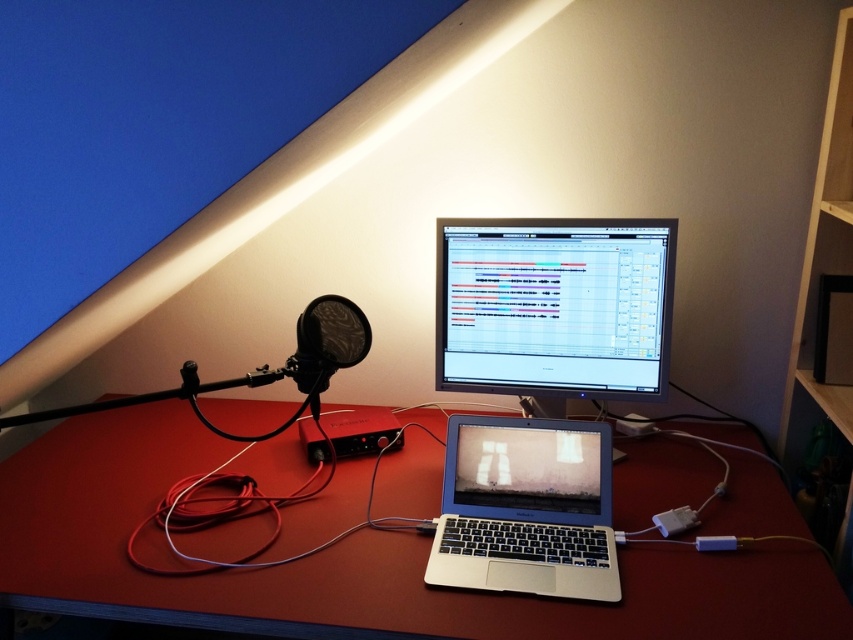
Question: Can you confirm if smooth wooden desk at center is smaller than matte black microphone at left?

Choices:
 (A) no
 (B) yes

Answer: (A)

Question: Based on their relative distances, which object is farther from the matte black monitor at center?

Choices:
 (A) silver metallic laptop at center
 (B) smooth wooden desk at center

Answer: (B)

Question: Does smooth wooden desk at center appear under matte black microphone at left?

Choices:
 (A) yes
 (B) no

Answer: (A)

Question: Among these objects, which one is farthest from the camera?

Choices:
 (A) smooth wooden desk at center
 (B) silver metallic laptop at center
 (C) matte black monitor at center

Answer: (C)

Question: Which object appears farthest from the camera in this image?

Choices:
 (A) smooth wooden desk at center
 (B) silver metallic laptop at center
 (C) matte black microphone at left

Answer: (C)

Question: Considering the relative positions of smooth wooden desk at center and matte black microphone at left in the image provided, where is smooth wooden desk at center located with respect to matte black microphone at left?

Choices:
 (A) right
 (B) left

Answer: (A)